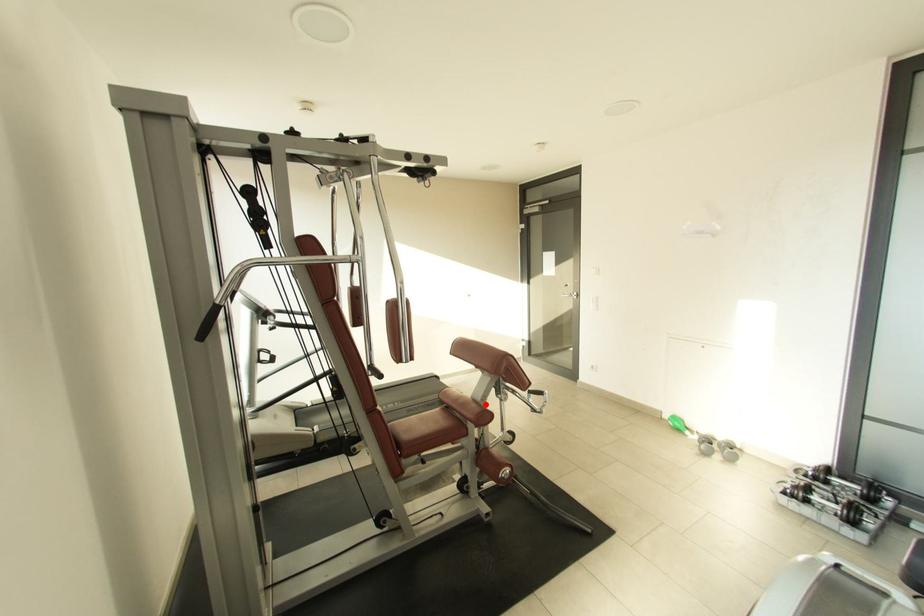
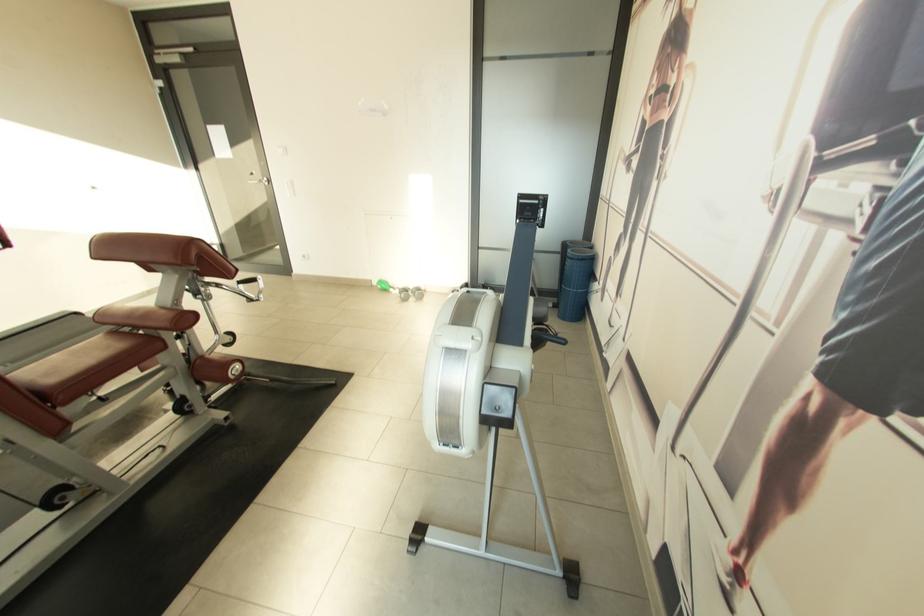
Locate, in the second image, the point that corresponds to the highlighted location in the first image.

(178, 309)